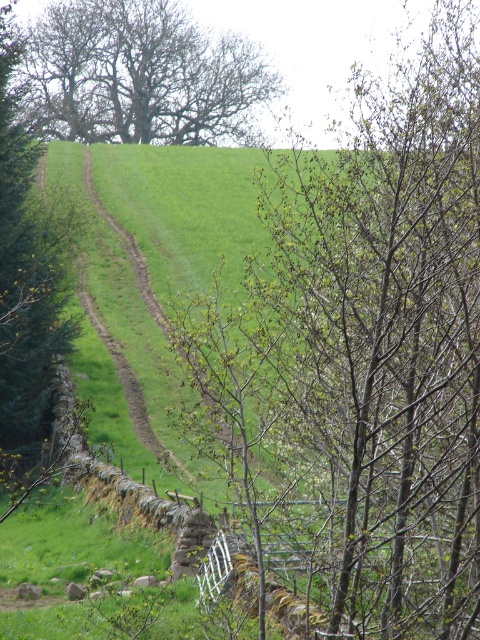
You are a hiker standing at the bottom of the hill looking up. You see two green leafy trees in the scene. Which tree is positioned lower on the hill, the green leafy tree at center or the green leafy tree at upper left?

The green leafy tree at center is positioned lower on the hill since it is below the green leafy tree at upper left.

You are a hiker planning to walk along the dirt path on the hill. You notice the green leafy tree at center and the brown textured tree at upper left. Which tree would you see first as you walk up the path?

The brown textured tree at upper left would be seen first because it is positioned higher up on the slope compared to the green leafy tree at center.